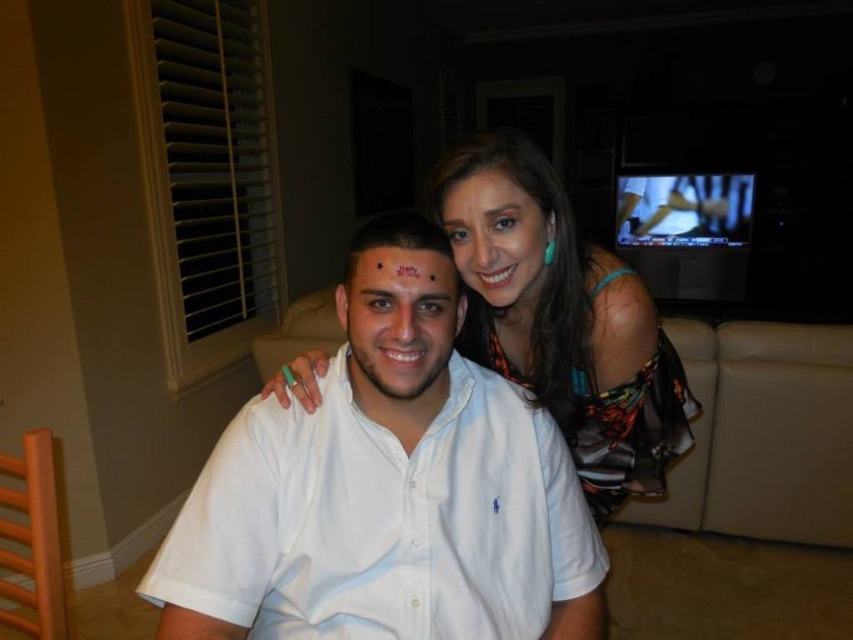
Question: Can you confirm if white cotton shirt at center is bigger than matte black forehead at center?

Choices:
 (A) no
 (B) yes

Answer: (B)

Question: Estimate the real-world distances between objects in this image. Which object is farther from the multicolored sheer dress at upper right?

Choices:
 (A) white matte shirt at center
 (B) matte black hair at upper center
 (C) matte black forehead at center
 (D) white cotton shirt at center

Answer: (C)

Question: Which point is closer to the camera taking this photo?

Choices:
 (A) [479, 372]
 (B) [366, 328]

Answer: (B)

Question: Does white cotton shirt at center have a smaller size compared to white matte shirt at center?

Choices:
 (A) no
 (B) yes

Answer: (A)

Question: Which point is farther from the camera taking this photo?

Choices:
 (A) (548, 230)
 (B) (369, 381)

Answer: (A)

Question: Observing the image, what is the correct spatial positioning of white matte shirt at center in reference to matte black forehead at center?

Choices:
 (A) above
 (B) below

Answer: (B)